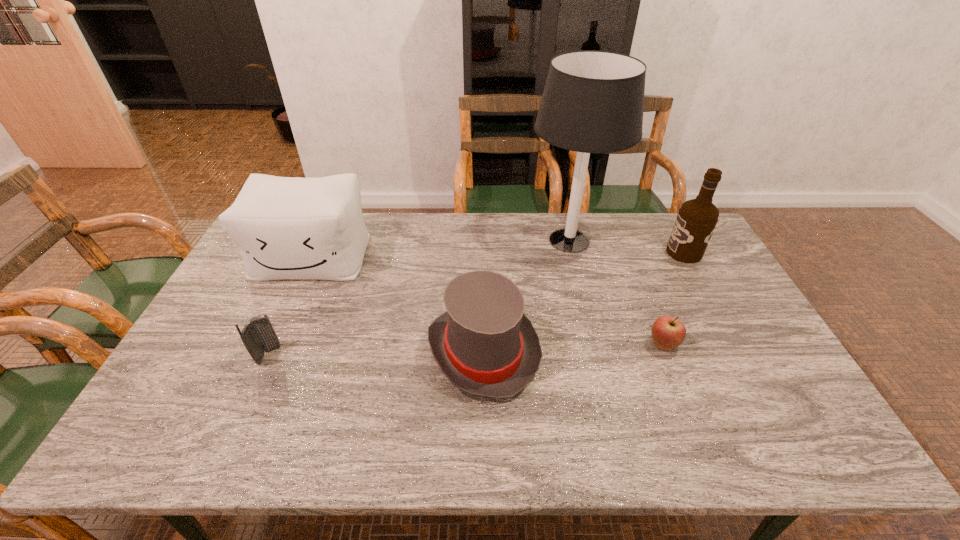
Where is `vacant position located 0.250m on the side of the cushion with the smiley face`? Image resolution: width=960 pixels, height=540 pixels. vacant position located 0.250m on the side of the cushion with the smiley face is located at coordinates (272, 346).

Find the location of `free space located on the back of the fourth tallest object`. free space located on the back of the fourth tallest object is located at coordinates (483, 258).

You are a GUI agent. You are given a task and a screenshot of the screen. Output one action in this format:
    pyautogui.click(x=<x>, y=<y>)
    Task: Click on the free location located on the keyboard of the cellular telephone
    The height and width of the screenshot is (540, 960).
    Given the screenshot: What is the action you would take?
    pyautogui.click(x=304, y=355)

Identify the location of free space located 0.230m on the back of the shortest object. (636, 278).

Locate an element on the screen. table lamp present at the far edge is located at coordinates (593, 101).

Identify the location of alcohol that is at the far edge. This screenshot has width=960, height=540. (696, 220).

Where is `cushion that is at the far edge`? cushion that is at the far edge is located at coordinates (286, 227).

Locate an element on the screen. This screenshot has height=540, width=960. object that is at the left edge is located at coordinates (286, 227).

Image resolution: width=960 pixels, height=540 pixels. Find the location of `object at the right edge`. object at the right edge is located at coordinates (696, 220).

You are a GUI agent. You are given a task and a screenshot of the screen. Output one action in this format:
    pyautogui.click(x=<x>, y=<y>)
    Task: Click on the object positioned at the far left corner
    Image resolution: width=960 pixels, height=540 pixels.
    Given the screenshot: What is the action you would take?
    pyautogui.click(x=286, y=227)